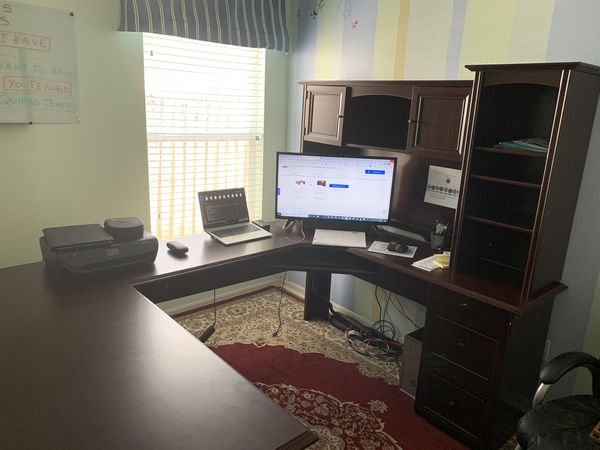
The height and width of the screenshot is (450, 600). What are the coordinates of `computer printer` in the screenshot? It's located at (116, 255).